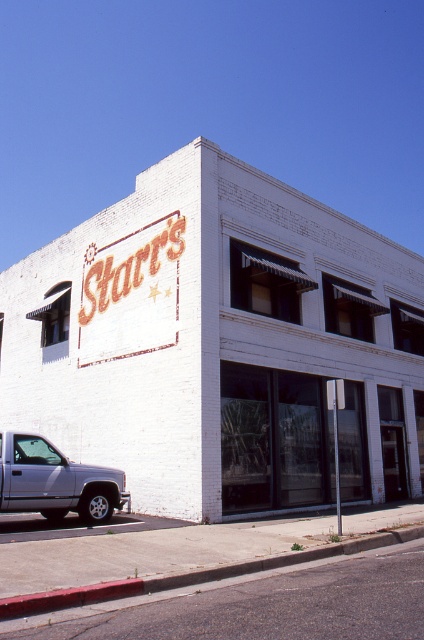
Who is positioned more to the left, white brick building at center or silver metallic truck at lower left?

From the viewer's perspective, silver metallic truck at lower left appears more on the left side.

Does white brick building at center lie behind silver metallic truck at lower left?

Yes.

You are a GUI agent. You are given a task and a screenshot of the screen. Output one action in this format:
    pyautogui.click(x=<x>, y=<y>)
    Task: Click on the white brick building at center
    The height and width of the screenshot is (640, 424).
    Given the screenshot: What is the action you would take?
    pyautogui.click(x=220, y=342)

I want to click on white brick building at center, so click(220, 342).

Which is above, silver metallic truck at lower left or concrete curb at lower center?

concrete curb at lower center

Is silver metallic truck at lower left smaller than concrete curb at lower center?

Incorrect, silver metallic truck at lower left is not smaller in size than concrete curb at lower center.

Does point (35, 440) lie in front of point (402, 529)?

No, (35, 440) is further to viewer.

This screenshot has height=640, width=424. In order to click on silver metallic truck at lower left in this screenshot , I will do `click(55, 481)`.

Identify the location of white brick building at center. (220, 342).

Does white brick building at center have a lesser width compared to concrete curb at lower center?

No, white brick building at center is not thinner than concrete curb at lower center.

Describe the element at coordinates (220, 342) in the screenshot. This screenshot has width=424, height=640. I see `white brick building at center` at that location.

Identify the location of white brick building at center. The image size is (424, 640). (220, 342).